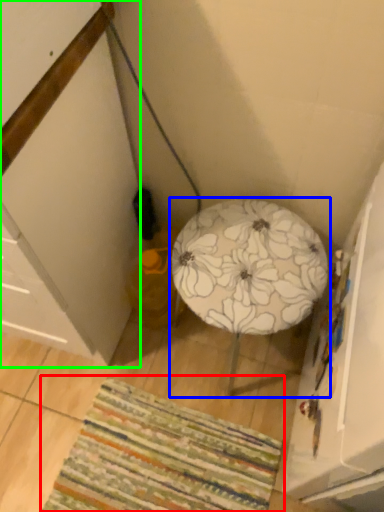
Question: Estimate the real-world distances between objects in this image. Which object is farther from mat (highlighted by a red box), furniture (highlighted by a blue box) or cabinetry (highlighted by a green box)?

Choices:
 (A) furniture
 (B) cabinetry

Answer: (A)